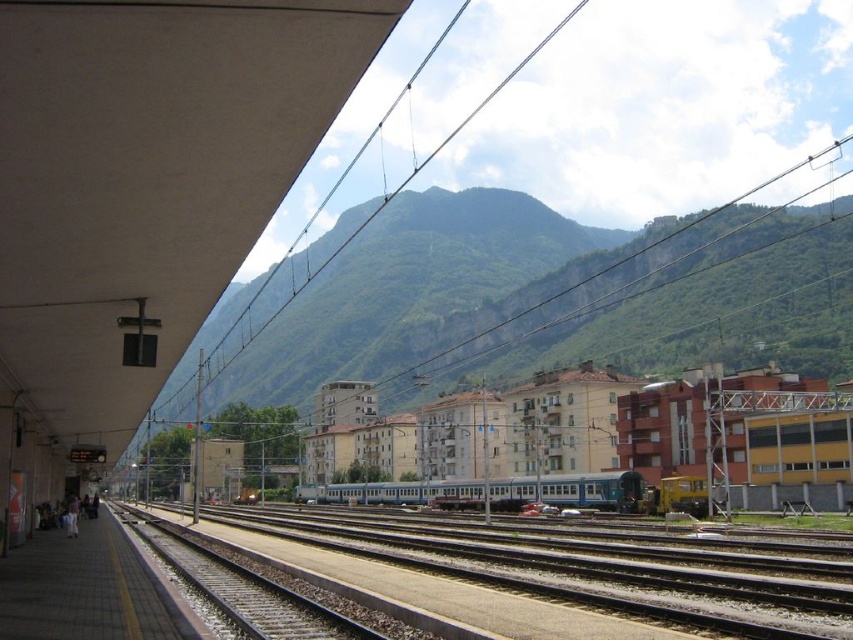
You are standing on the platform and want to board the silver metallic train at center. Which direction should you walk to reach it from the metallic tracks at center?

Since the metallic tracks at center are closer to you than the silver metallic train at center, you should walk away from the metallic tracks at center towards the silver metallic train at center along the platform to reach it.